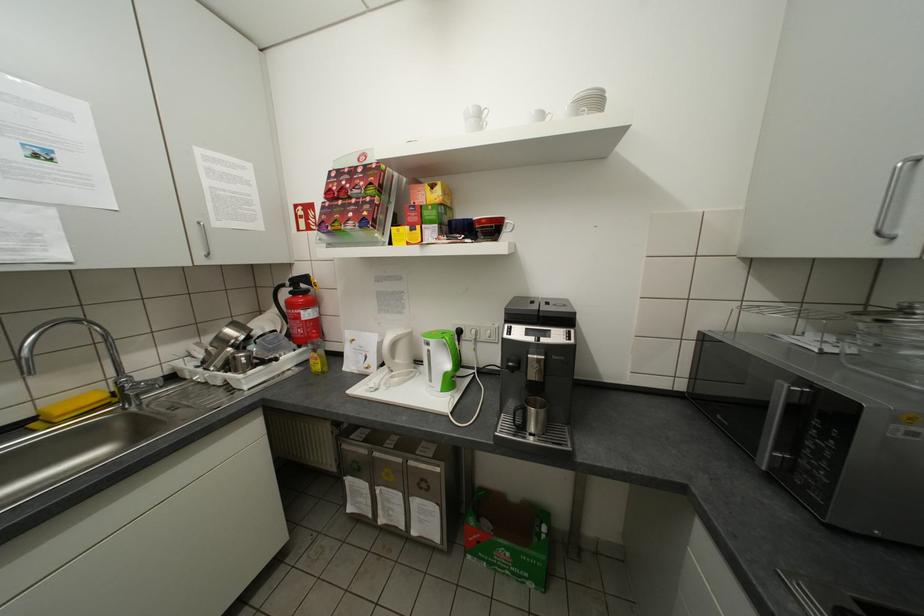
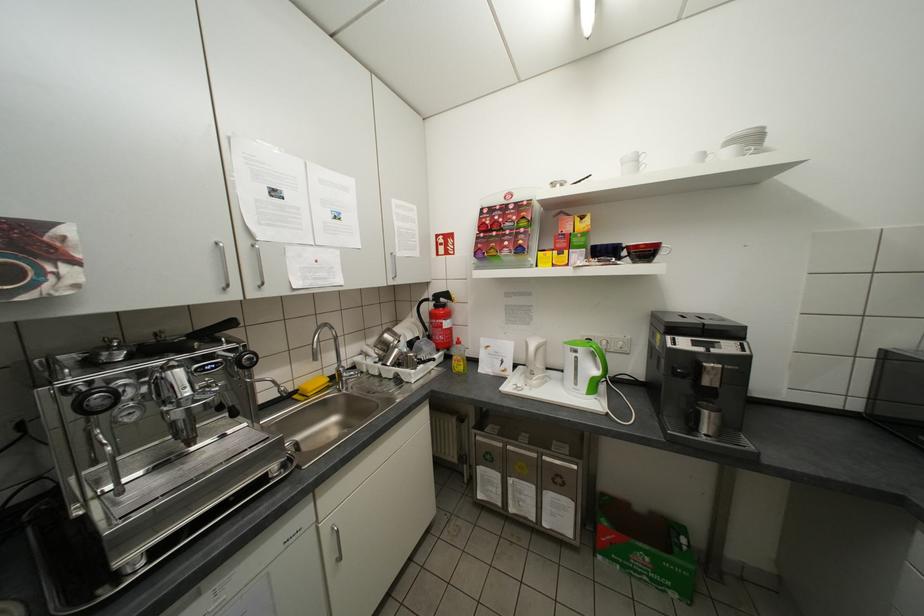
The point at (546,530) is marked in the first image. Where is the corresponding point in the second image?

(685, 541)